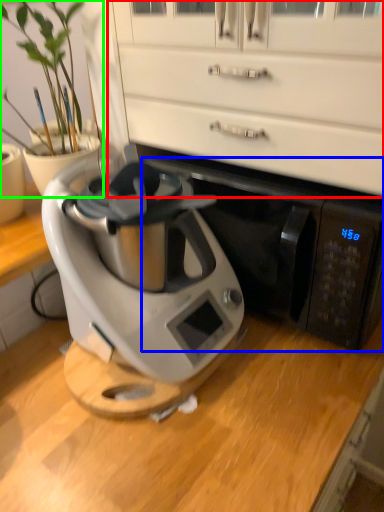
Question: Which object is the farthest from dresser (highlighted by a red box)? Choose among these: wide (highlighted by a blue box) or houseplant (highlighted by a green box).

Choices:
 (A) wide
 (B) houseplant

Answer: (B)